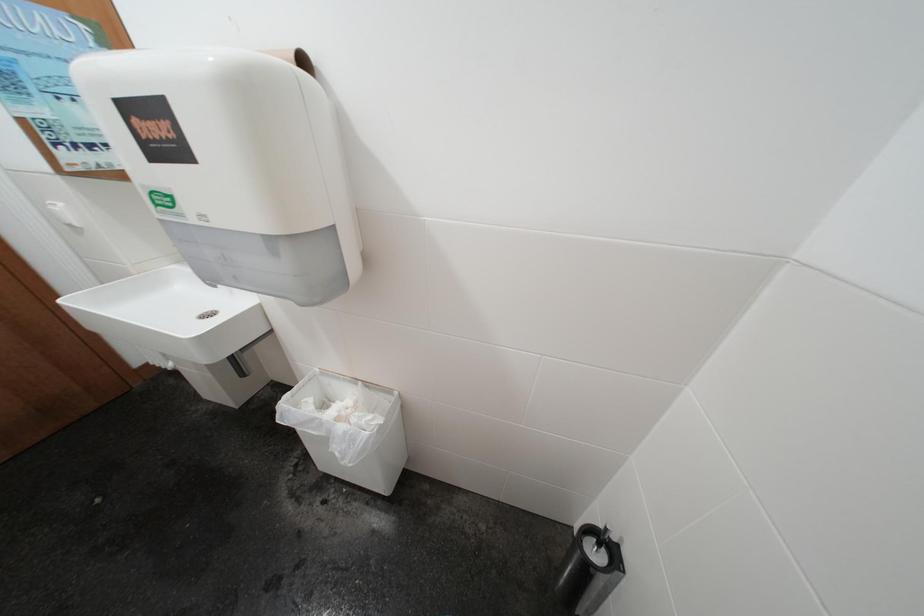
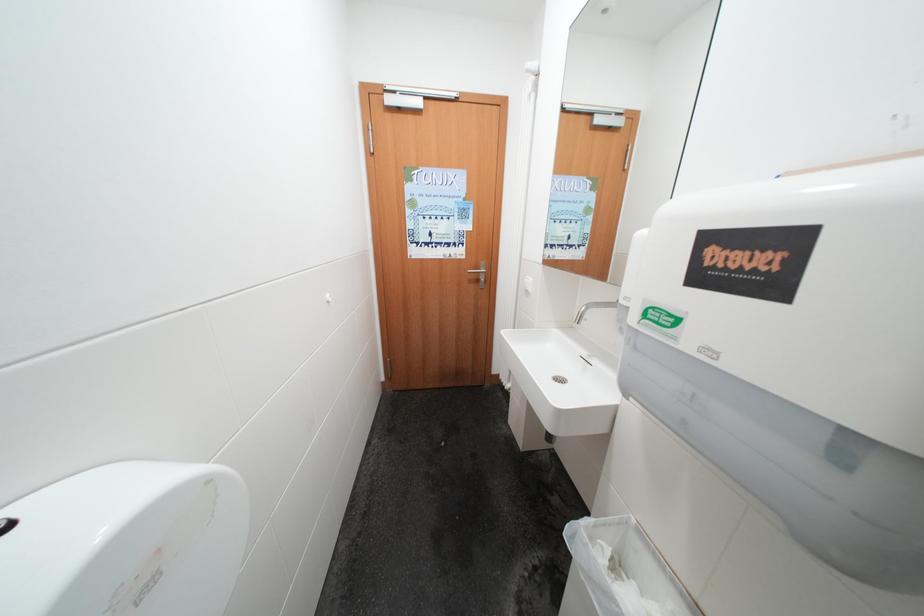
Question: The camera is either moving clockwise (left) or counter-clockwise (right) around the object. The first image is from the beginning of the video and the second image is from the end. Is the camera moving left or right when shooting the video?

Choices:
 (A) Left
 (B) Right

Answer: (B)